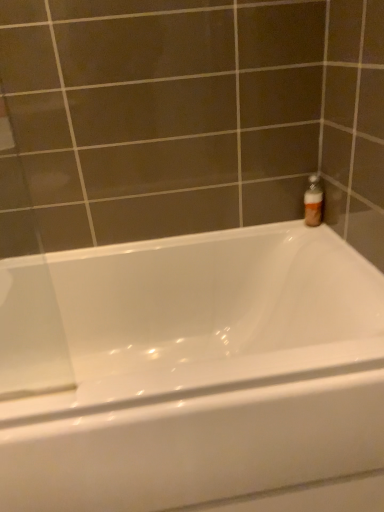
Question: Is translucent plastic bottle at upper right closer to the viewer compared to white glossy bathtub at upper right?

Choices:
 (A) no
 (B) yes

Answer: (A)

Question: From a real-world perspective, is translucent plastic bottle at upper right positioned over white glossy bathtub at upper right based on gravity?

Choices:
 (A) yes
 (B) no

Answer: (A)

Question: Is translucent plastic bottle at upper right at the right side of white glossy bathtub at upper right?

Choices:
 (A) yes
 (B) no

Answer: (A)

Question: Does translucent plastic bottle at upper right contain white glossy bathtub at upper right?

Choices:
 (A) no
 (B) yes

Answer: (A)

Question: Considering the relative sizes of translucent plastic bottle at upper right and white glossy bathtub at upper right in the image provided, is translucent plastic bottle at upper right shorter than white glossy bathtub at upper right?

Choices:
 (A) yes
 (B) no

Answer: (A)

Question: Considering the relative sizes of translucent plastic bottle at upper right and white glossy bathtub at upper right in the image provided, is translucent plastic bottle at upper right thinner than white glossy bathtub at upper right?

Choices:
 (A) no
 (B) yes

Answer: (B)

Question: Does white glossy bathtub at upper right have a lesser height compared to translucent plastic bottle at upper right?

Choices:
 (A) no
 (B) yes

Answer: (A)

Question: Can you confirm if white glossy bathtub at upper right is smaller than translucent plastic bottle at upper right?

Choices:
 (A) yes
 (B) no

Answer: (B)

Question: From the image's perspective, is white glossy bathtub at upper right on translucent plastic bottle at upper right?

Choices:
 (A) no
 (B) yes

Answer: (A)

Question: Is white glossy bathtub at upper right bigger than translucent plastic bottle at upper right?

Choices:
 (A) no
 (B) yes

Answer: (B)

Question: Is white glossy bathtub at upper right positioned with its back to translucent plastic bottle at upper right?

Choices:
 (A) yes
 (B) no

Answer: (B)

Question: From the image's perspective, does white glossy bathtub at upper right appear lower than translucent plastic bottle at upper right?

Choices:
 (A) yes
 (B) no

Answer: (A)

Question: From a real-world perspective, relative to translucent plastic bottle at upper right, is white glossy bathtub at upper right vertically above or below?

Choices:
 (A) below
 (B) above

Answer: (A)